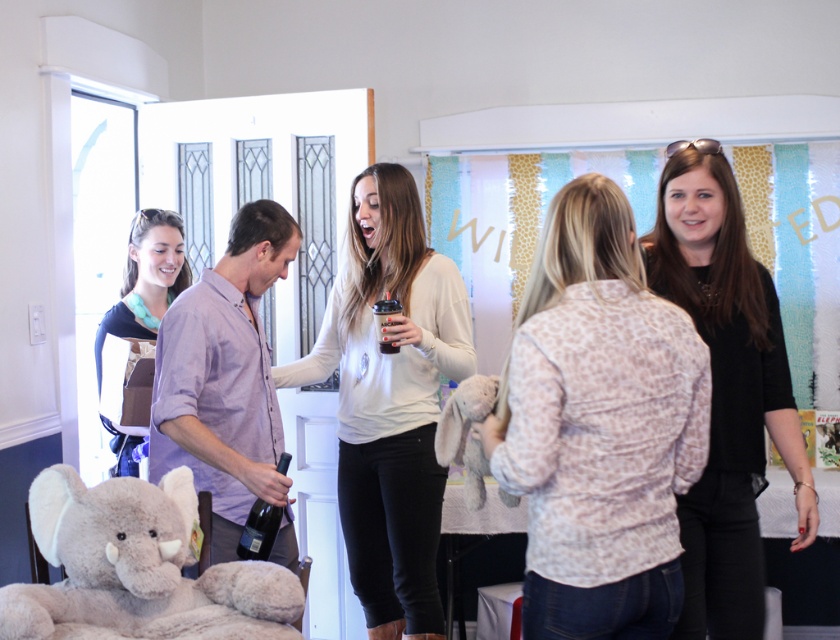
Can you confirm if white matte sweater at center is taller than matte black shirt at left?

Indeed, white matte sweater at center has a greater height compared to matte black shirt at left.

Between white matte sweater at center and matte black shirt at left, which one appears on the left side from the viewer's perspective?

From the viewer's perspective, matte black shirt at left appears more on the left side.

Who is more forward, (434, 307) or (155, 317)?

Point (434, 307) is in front.

Locate an element on the screen. The height and width of the screenshot is (640, 840). white matte sweater at center is located at coordinates (390, 400).

Does leopard print blouse at center appear over white matte sweater at center?

Yes.

Does point (547, 381) come behind point (411, 250)?

That is False.

The width and height of the screenshot is (840, 640). What are the coordinates of `leopard print blouse at center` in the screenshot? It's located at [597, 426].

Between point (79, 538) and point (171, 237), which one is positioned in front?

Positioned in front is point (79, 538).

Is soft plush elephant at lower left below matte black shirt at left?

Correct, soft plush elephant at lower left is located below matte black shirt at left.

What do you see at coordinates (137, 568) in the screenshot? I see `soft plush elephant at lower left` at bounding box center [137, 568].

At what (x,y) coordinates should I click in order to perform the action: click on soft plush elephant at lower left. Please return your answer as a coordinate pair (x, y). Looking at the image, I should click on (137, 568).